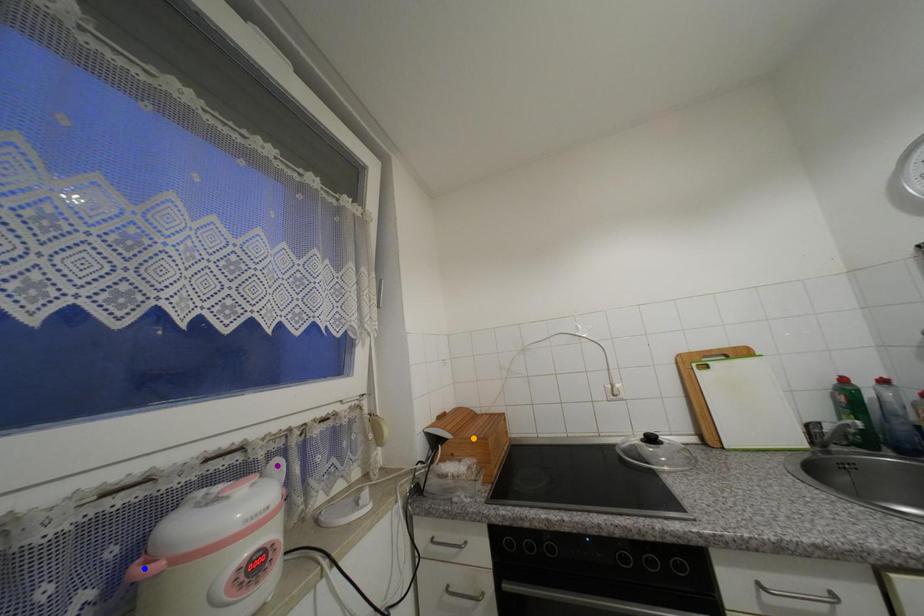
Order these from nearest to farthest:
A) blue point
B) orange point
C) purple point

blue point
purple point
orange point